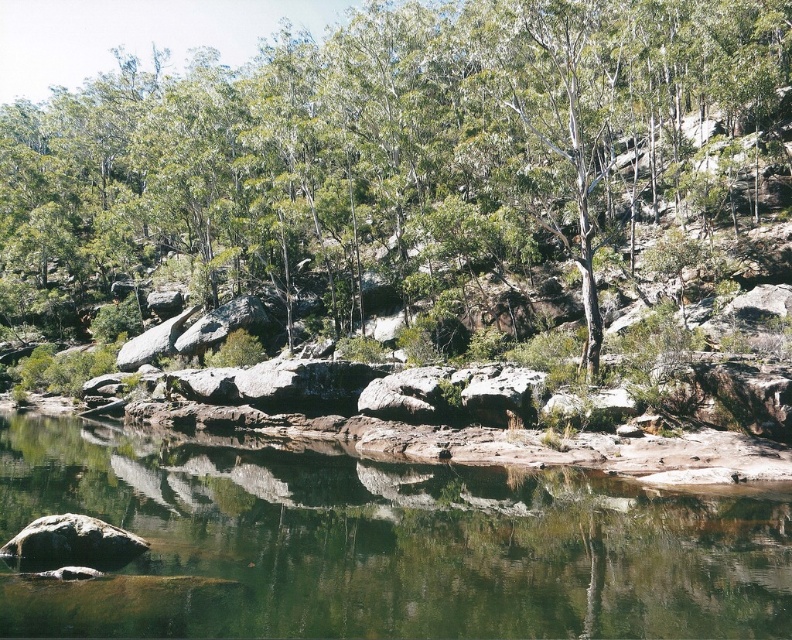
Is point (600, 225) farther from camera compared to point (115, 552)?

Yes, it is behind point (115, 552).

From the picture: Does green leafy tree at center appear over smooth gray rock at lower left?

Correct, green leafy tree at center is located above smooth gray rock at lower left.

This screenshot has width=792, height=640. Describe the element at coordinates (406, 166) in the screenshot. I see `green leafy tree at center` at that location.

Where is `green leafy tree at center`? Image resolution: width=792 pixels, height=640 pixels. green leafy tree at center is located at coordinates (406, 166).

Can you confirm if clear water at center is positioned to the left of smooth gray rock at lower left?

In fact, clear water at center is to the right of smooth gray rock at lower left.

Which is behind, point (63, 508) or point (32, 525)?

The point (63, 508) is more distant.

Who is more forward, (711, 554) or (27, 532)?

Point (27, 532) is more forward.

Where is `clear water at center`? clear water at center is located at coordinates (381, 545).

From the picture: Which of these two, green leafy tree at center or clear water at center, stands shorter?

Standing shorter between the two is clear water at center.

Between green leafy tree at center and clear water at center, which one appears on the left side from the viewer's perspective?

Positioned to the left is green leafy tree at center.

Identify the location of green leafy tree at center. This screenshot has width=792, height=640. (406, 166).

Locate an element on the screen. Image resolution: width=792 pixels, height=640 pixels. green leafy tree at center is located at coordinates (406, 166).